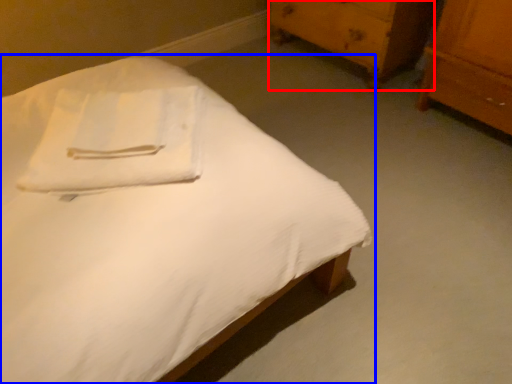
Question: Which of the following is the closest to the observer, chest of drawers (highlighted by a red box) or bed (highlighted by a blue box)?

Choices:
 (A) chest of drawers
 (B) bed

Answer: (B)